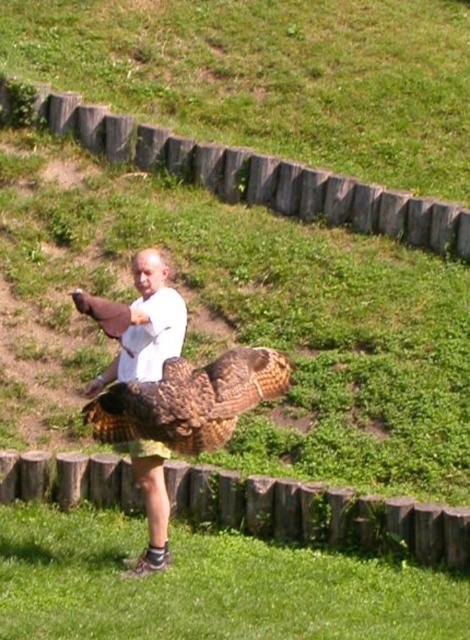
This screenshot has height=640, width=470. What do you see at coordinates (189, 401) in the screenshot? I see `brown feathered eagle at center` at bounding box center [189, 401].

Can you confirm if brown feathered eagle at center is positioned below white matte shirt at center?

Yes, brown feathered eagle at center is below white matte shirt at center.

Is point (115, 392) farther from camera compared to point (165, 346)?

No, (115, 392) is in front of (165, 346).

Find the location of a particular element. This screenshot has width=470, height=640. brown feathered eagle at center is located at coordinates (189, 401).